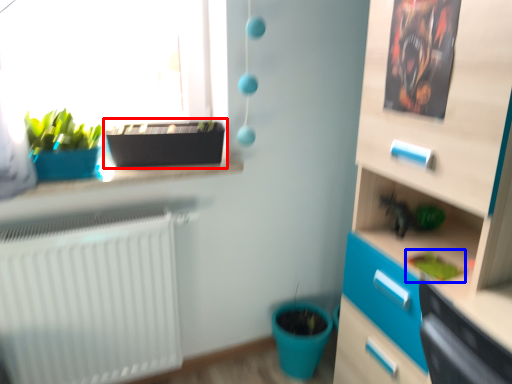
Question: Which point is further to the camera, flowerpot (highlighted by a red box) or plant (highlighted by a blue box)?

Choices:
 (A) flowerpot
 (B) plant

Answer: (A)